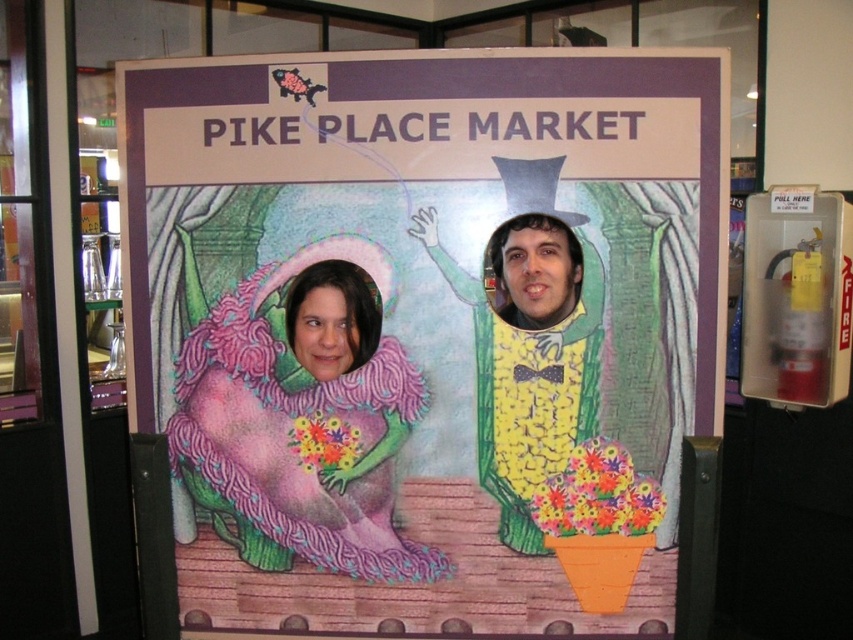
Question: Considering the real-world distances, which object is farthest from the pink fuzzy dress at center?

Choices:
 (A) matte cardboard poster at center
 (B) yellow matte corn at center

Answer: (B)

Question: Is the position of matte cardboard poster at center more distant than that of smooth yellow corn at center?

Choices:
 (A) no
 (B) yes

Answer: (A)

Question: Does matte cardboard poster at center have a greater width compared to yellow matte corn at center?

Choices:
 (A) yes
 (B) no

Answer: (A)

Question: Which of the following is the closest to the observer?

Choices:
 (A) matte cardboard poster at center
 (B) pink fuzzy dress at center
 (C) smooth yellow corn at center
 (D) yellow matte corn at center

Answer: (A)

Question: Does pink fuzzy dress at center appear over yellow matte corn at center?

Choices:
 (A) no
 (B) yes

Answer: (A)

Question: Which object is closer to the camera taking this photo?

Choices:
 (A) matte cardboard poster at center
 (B) smooth yellow corn at center
 (C) yellow matte corn at center

Answer: (A)